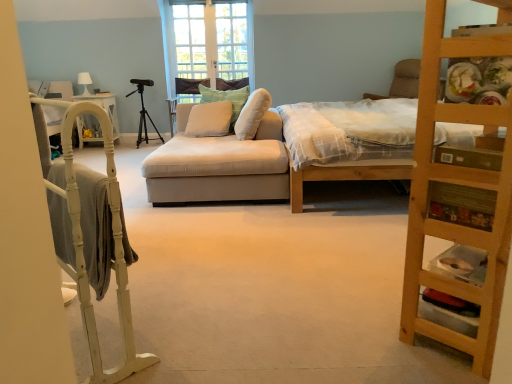
Locate an element on the screen. The image size is (512, 384). vacant space to the right of white painted wood bunk bed at left is located at coordinates (195, 324).